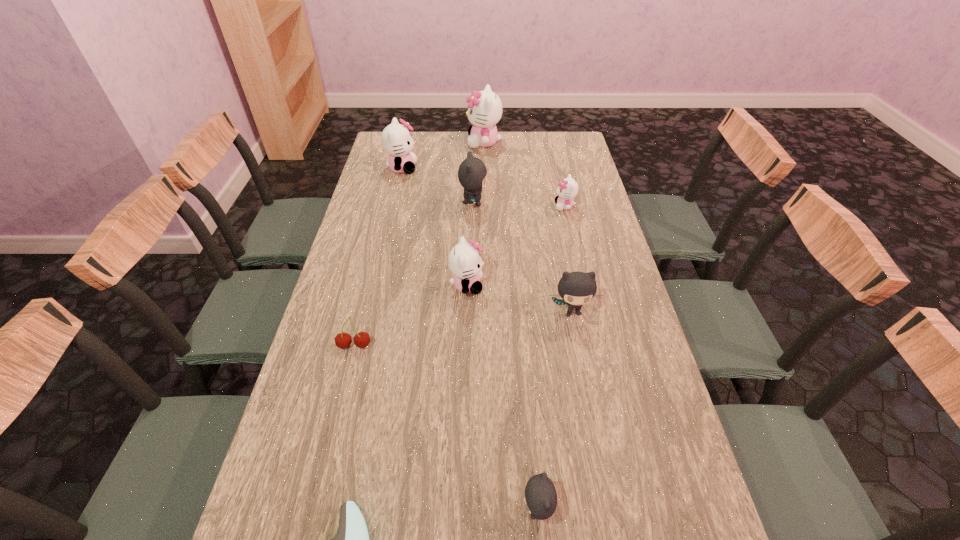
Find the location of a particular element. vacant area between the second farthest white kitten and the farthest gray kitten is located at coordinates (438, 186).

Locate an element on the screen. This screenshot has height=540, width=960. vacant space that's between the nearest white kitten and the cherry is located at coordinates (411, 315).

The height and width of the screenshot is (540, 960). I want to click on vacant region between the leftmost gray kitten and the second farthest gray kitten, so click(x=522, y=258).

Identify the location of vacant point located between the second biggest gray kitten and the farthest white kitten. (528, 227).

Locate an element on the screen. The image size is (960, 540). object identified as the sixth closest to the rightmost white kitten is located at coordinates (362, 339).

Where is `object that ranks as the fourth closest to the eighth nearest object`? object that ranks as the fourth closest to the eighth nearest object is located at coordinates pyautogui.click(x=567, y=189).

Identify the location of kitten that is the sixth closest to the farthest gray kitten. (540, 498).

What are the coordinates of `kitten that is the sixth nearest to the biggest gray kitten` in the screenshot? It's located at (540, 498).

At what (x,y) coordinates should I click in order to perform the action: click on white kitten that is the third closest to the leftmost kitten. Please return your answer as a coordinate pair (x, y). This screenshot has height=540, width=960. Looking at the image, I should click on (567, 189).

Find the location of `white kitten that is the second nearest to the leftmost gray kitten`. white kitten that is the second nearest to the leftmost gray kitten is located at coordinates (567, 189).